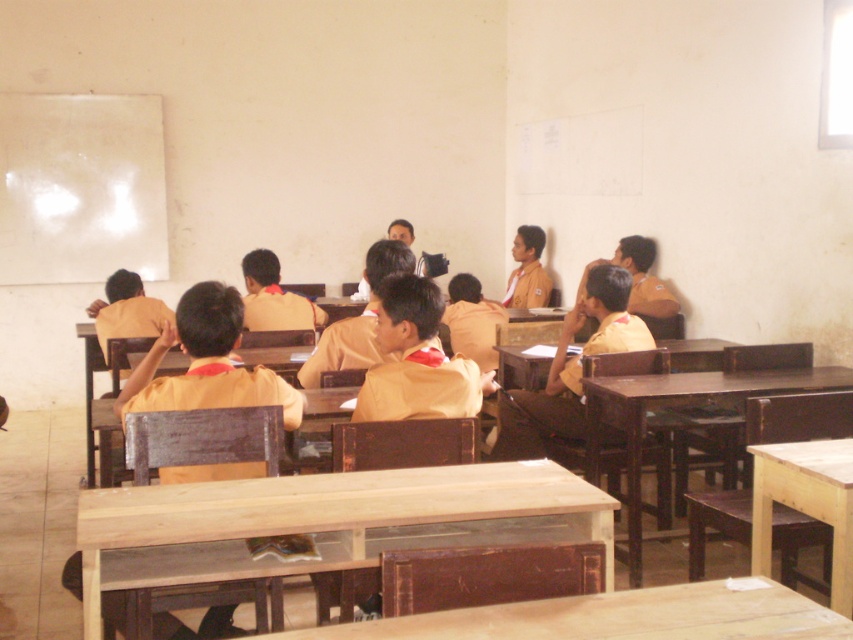
You are standing at the front of the classroom and want to place a small plant on the light brown wooden table at center. To do so, you need to walk towards the table. In which direction should you move relative to your current position?

Since the light brown wooden table at center is located at point (x=328, y=509), you should move towards the center of the classroom to reach it.

You are a student in the classroom and want to place your bag on the nearest table. Which table is closer to you, the light brown wooden table at center or the light brown wooden table at lower right?

The light brown wooden table at lower right is closer to you because it is positioned lower, meaning it is nearer in the classroom layout compared to the one at center which is above it.

Consider the image. You are standing in the classroom and want to place a small potted plant on the light brown wooden table at center. The coordinates of the table are given as point (328,509). Can you confirm if this coordinate point is the exact center of the table?

The point (328,509) corresponds to the light brown wooden table at center, so yes, this coordinate point is the exact center of the table.